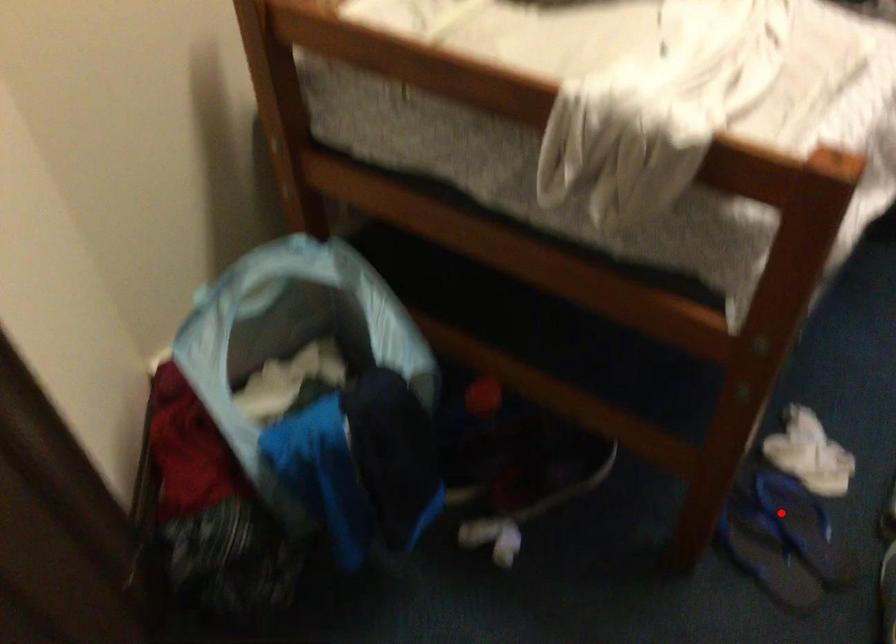
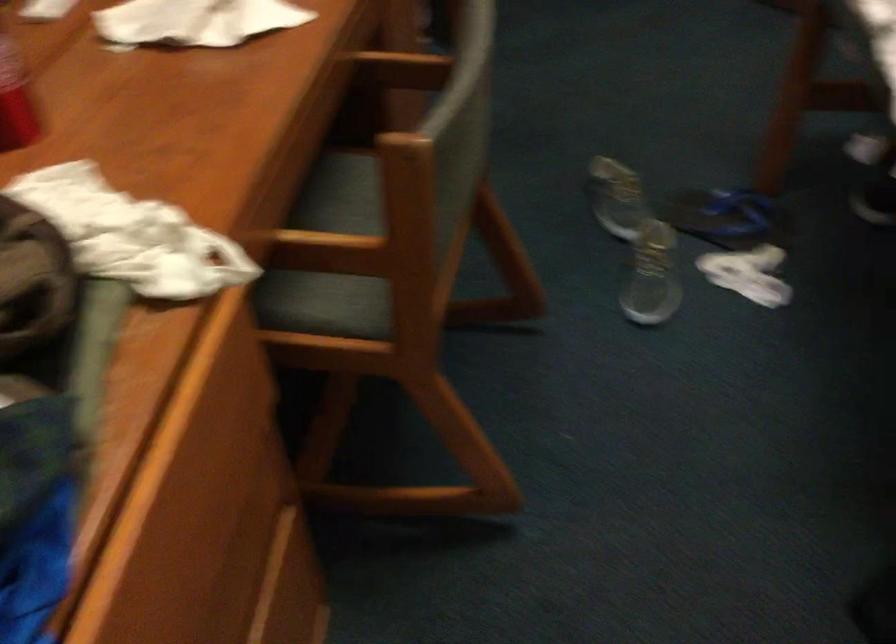
Find the pixel in the second image that matches the highlighted location in the first image.

(728, 218)